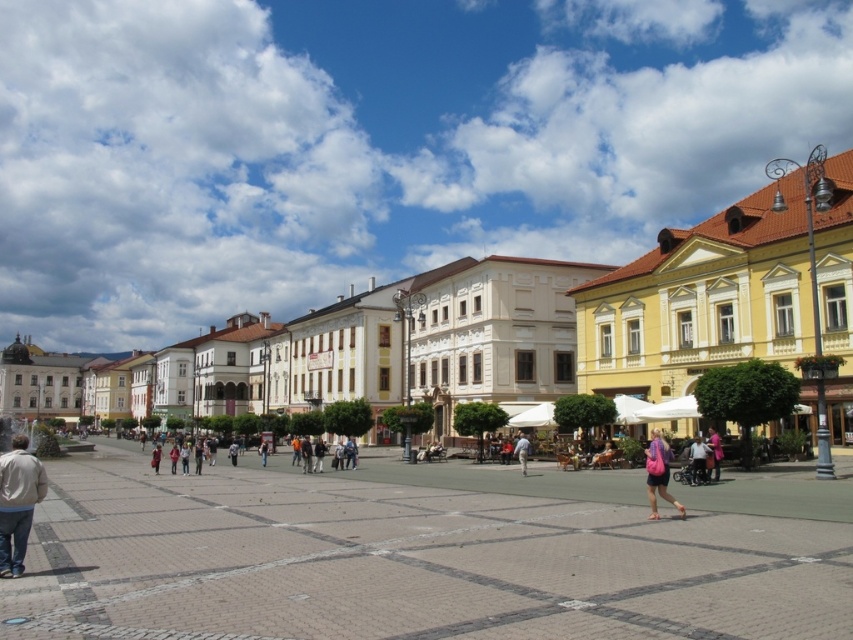
Who is higher up, yellow painted building at center or pink fabric bag at center?

yellow painted building at center is above.

Is yellow painted building at center smaller than pink fabric bag at center?

No, yellow painted building at center is not smaller than pink fabric bag at center.

The width and height of the screenshot is (853, 640). I want to click on yellow painted building at center, so click(x=724, y=298).

What do you see at coordinates (659, 474) in the screenshot?
I see `pink fabric bag at center` at bounding box center [659, 474].

Which of these two, pink fabric bag at center or pink fabric person at lower right, stands shorter?

Standing shorter between the two is pink fabric person at lower right.

Is point (660, 440) less distant than point (711, 438)?

That is True.

Image resolution: width=853 pixels, height=640 pixels. I want to click on pink fabric bag at center, so click(x=659, y=474).

Which of these two, pink fabric person at lower right or light blue denim jeans at center, stands taller?

Standing taller between the two is light blue denim jeans at center.

Is pink fabric person at lower right wider than light blue denim jeans at center?

Yes, pink fabric person at lower right is wider than light blue denim jeans at center.

Which is behind, point (712, 435) or point (521, 452)?

Point (521, 452)

This screenshot has height=640, width=853. I want to click on pink fabric person at lower right, so click(714, 451).